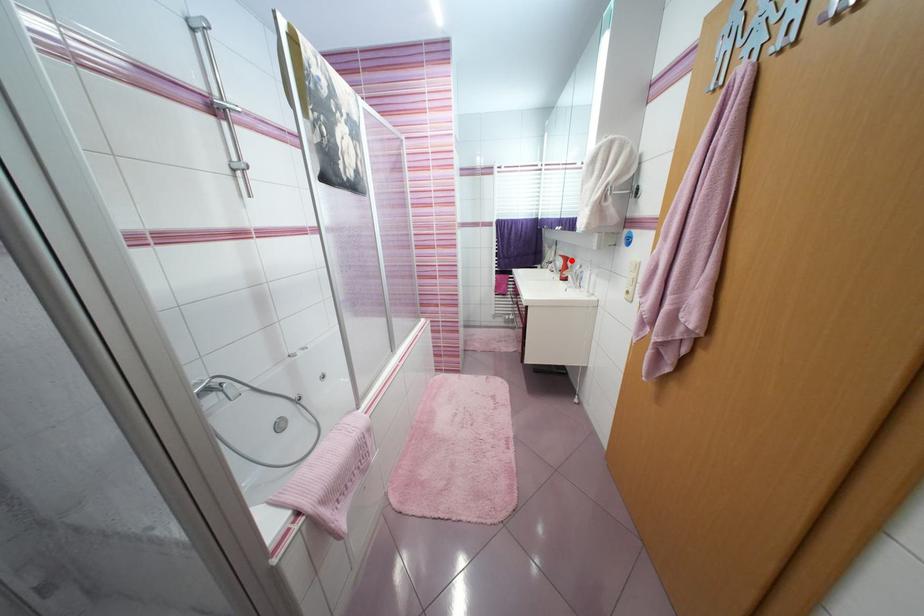
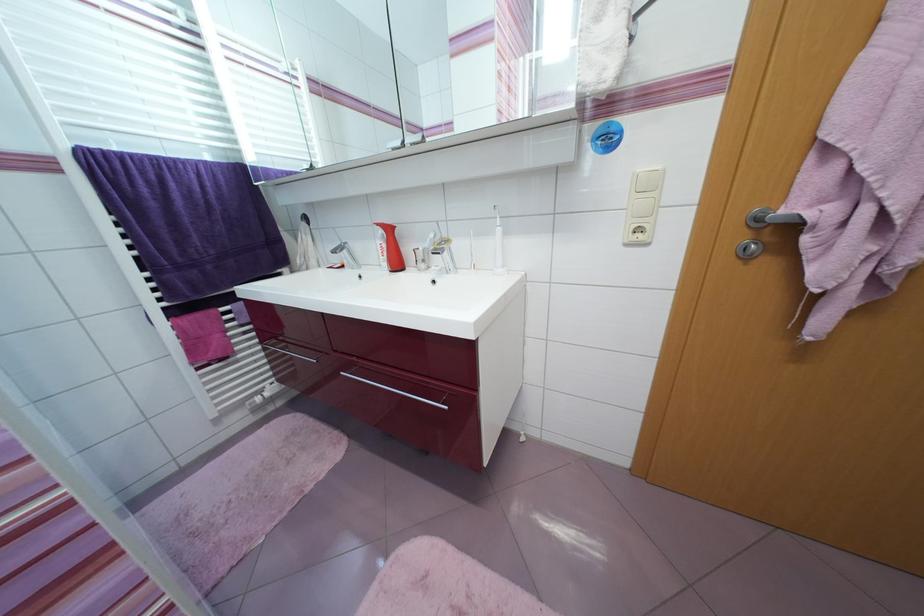
Where in the second image is the point corresponding to the highlighted location from the first image?

(394, 231)